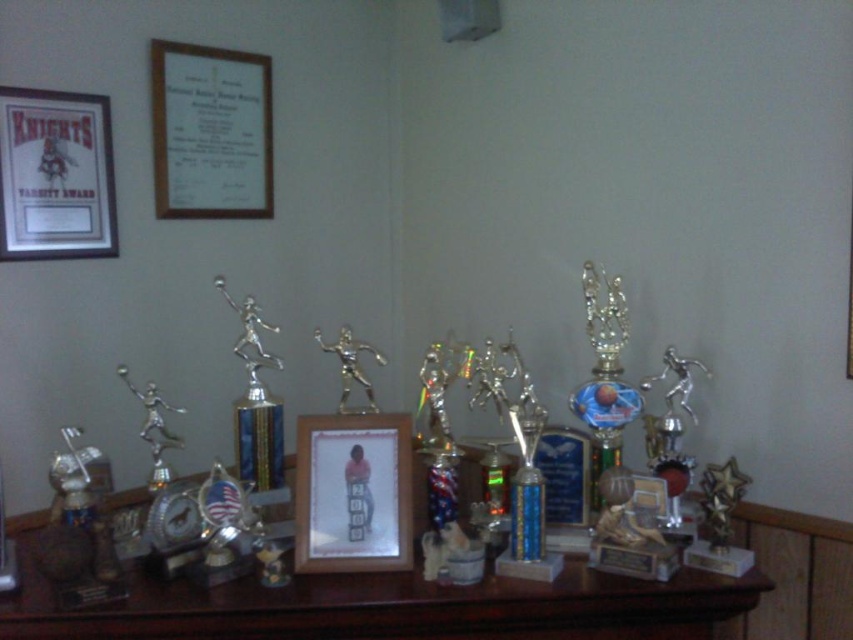
You are standing 1.5 meters away from the wooden shelf. You want to take a closer look at the wooden photo frame at center. Can you reach it without moving your position?

The wooden photo frame at center is 1.46 meters away from the camera, so yes, you can reach it without moving since you are standing 1.5 meters away from the shelf.

You are organizing a display in a museum and need to know the spatial relationship between the matte black frame at upper left and the wooden photo frame at center. Which one is placed above the other?

The matte black frame at upper left is positioned over wooden photo frame at center, meaning it is placed above the wooden photo frame at center.

You are standing in front of a shelf with trophies and a framed certificate labeled KNIGHTS. There is a point marked at coordinates point (432, 602). If you want to place a new trophy exactly halfway between the framed certificate labeled KNIGHTS and the point, where should you place it?

The point marked at (432, 602) and the framed certificate labeled KNIGHTS are 4.54 feet apart. To place the new trophy halfway between them, it should be placed 2.27 feet away from each object along the line connecting them.